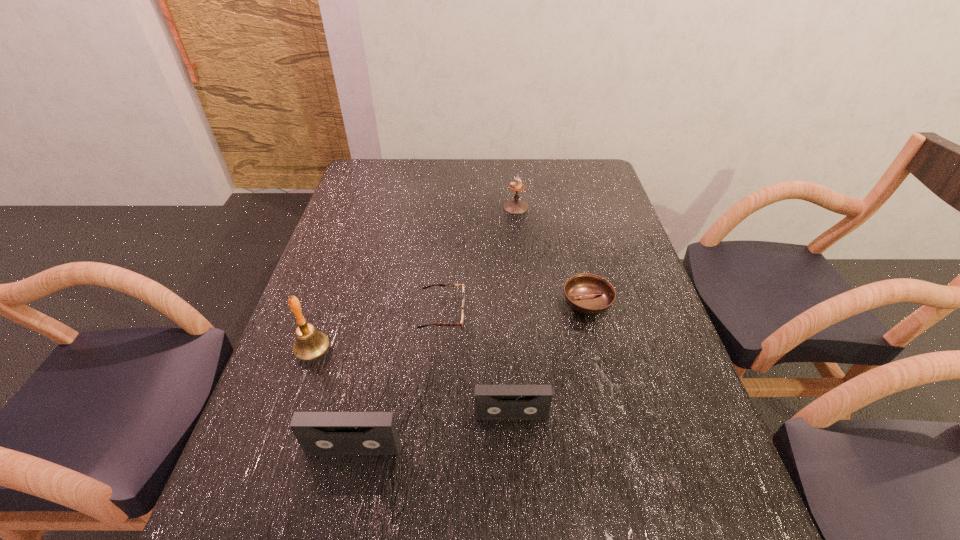
Find the location of a particular element. vacant space located on the front-facing side of the nearer videotape is located at coordinates (347, 481).

The height and width of the screenshot is (540, 960). I want to click on vacant space situated on the front-facing side of the shorter videotape, so click(x=514, y=458).

Identify the location of vacant space located 0.170m on the back of the farthest object. The width and height of the screenshot is (960, 540). (513, 174).

I want to click on vacant point located on the frame of the fourth object from right to left, so click(x=598, y=314).

This screenshot has width=960, height=540. In order to click on free region located 0.050m on the front of the bell in this screenshot , I will do `click(302, 384)`.

This screenshot has width=960, height=540. What are the coordinates of `free spot located on the front of the soup bowl` in the screenshot? It's located at (608, 387).

In order to click on object that is at the near edge in this screenshot , I will do `click(319, 433)`.

This screenshot has height=540, width=960. In order to click on videotape situated at the left edge in this screenshot , I will do `click(319, 433)`.

You are a GUI agent. You are given a task and a screenshot of the screen. Output one action in this format:
    pyautogui.click(x=<x>, y=<y>)
    Task: Click on the bell present at the left edge
    
    Given the screenshot: What is the action you would take?
    pyautogui.click(x=310, y=343)

This screenshot has width=960, height=540. Find the location of `object at the right edge`. object at the right edge is located at coordinates (588, 294).